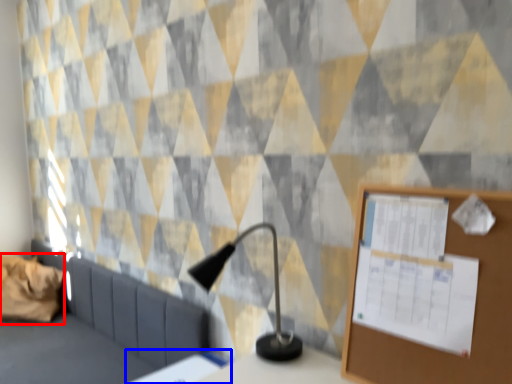
Question: Which object appears farthest to the camera in this image, pillow (highlighted by a red box) or table (highlighted by a blue box)?

Choices:
 (A) pillow
 (B) table

Answer: (A)